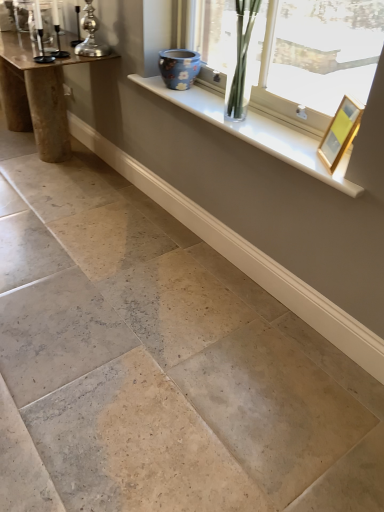
In order to click on blank space above natural stone floor at center (from a real-world perspective) in this screenshot , I will do `click(102, 279)`.